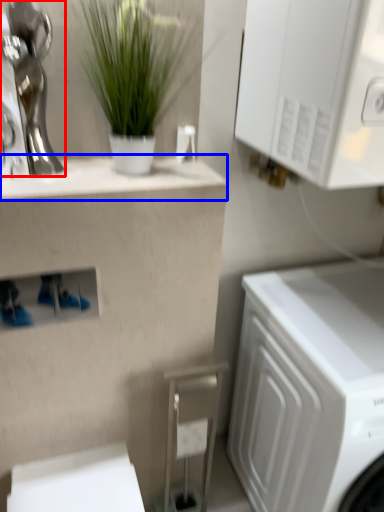
Question: Which of the following is the farthest to the observer, statue (highlighted by a red box) or counter top (highlighted by a blue box)?

Choices:
 (A) statue
 (B) counter top

Answer: (B)